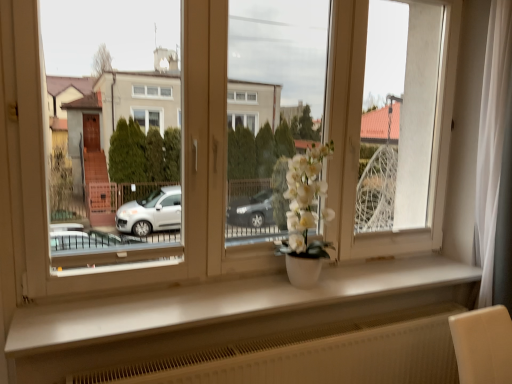
The image size is (512, 384). What are the coordinates of `white matte window sill at center` in the screenshot? It's located at (226, 303).

Consider the image. Which is more to the right, white matte window sill at center or white matte vase at center?

From the viewer's perspective, white matte vase at center appears more on the right side.

Could you tell me if white matte window sill at center is turned towards white matte vase at center?

No, white matte window sill at center is not turned towards white matte vase at center.

Is white matte window sill at center positioned in front of white matte vase at center?

Yes, it is in front of white matte vase at center.

Considering the relative positions of white matte window sill at center and white matte flower pot at center in the image provided, is white matte window sill at center to the left or to the right of white matte flower pot at center?

Clearly, white matte window sill at center is on the right of white matte flower pot at center in the image.

Which of these two, white matte window sill at center or white matte flower pot at center, is thinner?

white matte flower pot at center is thinner.

From the picture: Which object is further away from the camera, white matte window sill at center or white matte flower pot at center?

white matte flower pot at center is further from the camera.

How many degrees apart are the facing directions of white matte vase at center and white matte window sill at center?

They differ by 0.697 degrees in their facing directions.

Between point (303, 259) and point (34, 317), which one is positioned in front?

Positioned in front is point (34, 317).

Would you say white matte vase at center contains white matte window sill at center?

No, white matte window sill at center is not inside white matte vase at center.

Between white matte vase at center and white matte window sill at center, which one appears on the right side from the viewer's perspective?

white matte vase at center is more to the right.

Is white matte flower pot at center facing away from white matte vase at center?

Yes, white matte vase at center is at the back of white matte flower pot at center.

What's the angular difference between white matte flower pot at center and white matte vase at center's facing directions?

They differ by 0.626 degrees in their facing directions.

Is point (230, 125) closer to viewer compared to point (306, 182)?

That is False.

From the image's perspective, which one is positioned higher, white matte vase at center or white matte flower pot at center?

white matte flower pot at center, from the image's perspective.

Is white matte flower pot at center surrounded by white matte vase at center?

Actually, white matte flower pot at center is outside white matte vase at center.

Does white matte vase at center appear on the left side of white matte flower pot at center?

No.

Considering the positions of objects white matte vase at center and white matte flower pot at center in the image provided, who is behind, white matte vase at center or white matte flower pot at center?

white matte vase at center is behind.

Locate an element on the screen. window sill in front of the white matte flower pot at center is located at coordinates (226, 303).

Is white matte flower pot at center to the left of white matte window sill at center from the viewer's perspective?

Correct, you'll find white matte flower pot at center to the left of white matte window sill at center.

From a real-world perspective, does white matte flower pot at center stand above white matte window sill at center?

Result: Indeed, from a real-world perspective, white matte flower pot at center stands above white matte window sill at center.

In the scene shown: How many degrees apart are the facing directions of white matte flower pot at center and white matte window sill at center?

The angle between the facing direction of white matte flower pot at center and the facing direction of white matte window sill at center is 0.0715 degrees.

Where is `houseplant on the right of white matte window sill at center`? This screenshot has width=512, height=384. houseplant on the right of white matte window sill at center is located at coordinates (304, 217).

Find the location of `window sill below the white matte flower pot at center (from a real-world perspective)`. window sill below the white matte flower pot at center (from a real-world perspective) is located at coordinates pos(226,303).

Based on their spatial positions, is white matte vase at center or white matte flower pot at center further from white matte window sill at center?

white matte flower pot at center is further to white matte window sill at center.

Estimate the real-world distances between objects in this image. Which object is further from white matte vase at center, white matte window sill at center or white matte flower pot at center?

Among the two, white matte window sill at center is located further to white matte vase at center.

Looking at the image, which one is located closer to white matte flower pot at center, white matte vase at center or white matte window sill at center?

white matte vase at center lies closer to white matte flower pot at center than the other object.

Looking at the image, which one is located closer to white matte flower pot at center, white matte window sill at center or white matte vase at center?

white matte vase at center lies closer to white matte flower pot at center than the other object.

Considering their positions, is white matte flower pot at center positioned closer to white matte window sill at center than white matte vase at center?

white matte vase at center lies closer to white matte window sill at center than the other object.

From the image, which object appears to be farther from white matte vase at center, white matte flower pot at center or white matte window sill at center?

Based on the image, white matte window sill at center appears to be further to white matte vase at center.

What are the coordinates of `houseplant between white matte flower pot at center and white matte window sill at center in the up-down direction` in the screenshot? It's located at (304, 217).